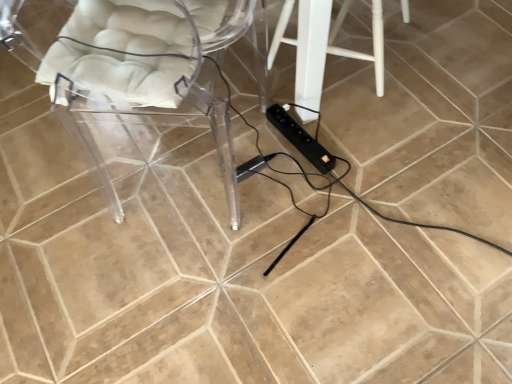
Question: In the image, is transparent acrylic chair at left positioned in front of or behind black plastic extension cord at center, the 2th extension cord from the left?

Choices:
 (A) front
 (B) behind

Answer: (A)

Question: Considering the positions of transparent acrylic chair at left and black plastic extension cord at center, which appears as the first extension cord when viewed from the right, in the image, is transparent acrylic chair at left wider or thinner than black plastic extension cord at center, which appears as the first extension cord when viewed from the right,?

Choices:
 (A) wide
 (B) thin

Answer: (A)

Question: Which object is the farthest from the black plastic extension cord at center, the 2th extension cord from the left?

Choices:
 (A) white painted wood stool at center
 (B) black plastic extension cord at center, the 1th extension cord in the left-to-right sequence
 (C) transparent acrylic chair at left

Answer: (C)

Question: Which of these objects is positioned farthest from the transparent acrylic chair at left?

Choices:
 (A) black plastic extension cord at center, which appears as the first extension cord when viewed from the right
 (B) black plastic extension cord at center, placed as the second extension cord when sorted from right to left
 (C) white painted wood stool at center

Answer: (A)